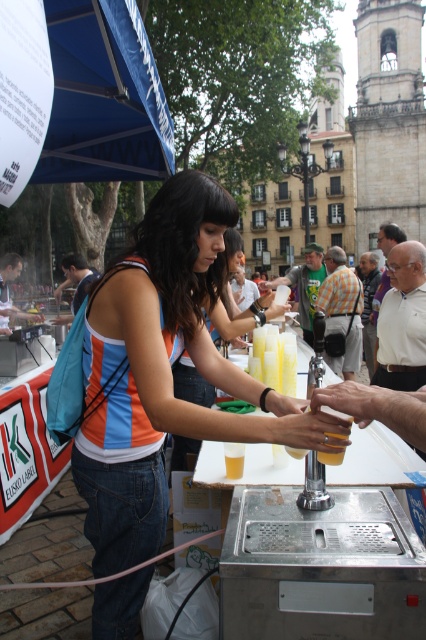
From the picture: You are a photographer at the event and want to take a photo of the woman serving drinks. The checkered fabric shirt at center and orange striped shirt at center are both visible in the frame. Which shirt should you focus on to ensure it appears larger in the photo?

The checkered fabric shirt at center is much taller than the orange striped shirt at center, so focusing on it will make it appear larger in the photo.